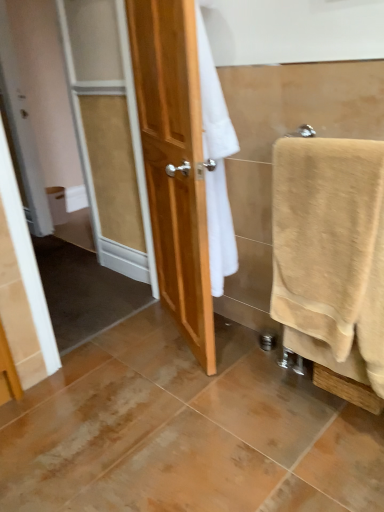
Question: In terms of width, does white matte toilet paper at left look wider or thinner when compared to beige cotton towel at right?

Choices:
 (A) thin
 (B) wide

Answer: (A)

Question: Does point tap(51, 214) appear closer or farther from the camera than point tap(291, 268)?

Choices:
 (A) closer
 (B) farther

Answer: (B)

Question: Is white matte toilet paper at left in front of or behind beige cotton towel at right in the image?

Choices:
 (A) behind
 (B) front

Answer: (A)

Question: Is point (289, 239) closer or farther from the camera than point (74, 189)?

Choices:
 (A) farther
 (B) closer

Answer: (B)

Question: Is beige cotton towel at right to the left or to the right of white matte toilet paper at left in the image?

Choices:
 (A) right
 (B) left

Answer: (A)

Question: Considering the positions of beige cotton towel at right and white matte toilet paper at left in the image, is beige cotton towel at right wider or thinner than white matte toilet paper at left?

Choices:
 (A) wide
 (B) thin

Answer: (A)

Question: Considering their positions, is beige cotton towel at right located in front of or behind white matte toilet paper at left?

Choices:
 (A) behind
 (B) front

Answer: (B)